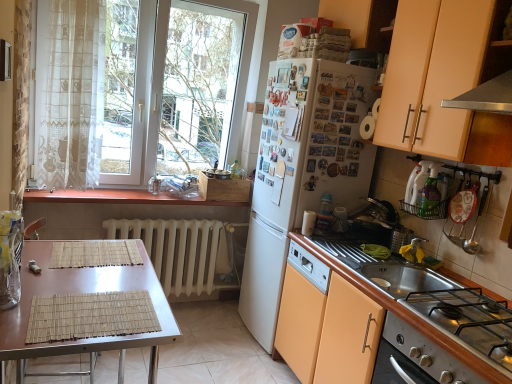
Where is `free space in front of white glossy cup at upper center, the second appliance in the right-to-left sequence`? Image resolution: width=512 pixels, height=384 pixels. free space in front of white glossy cup at upper center, the second appliance in the right-to-left sequence is located at coordinates (308, 243).